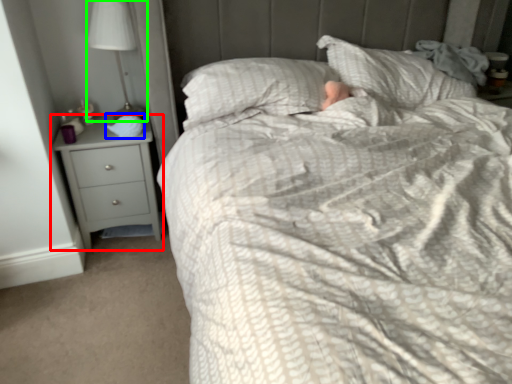
Question: Which is farther away from chest of drawers (highlighted by a red box)? sleeping bag (highlighted by a blue box) or lamp (highlighted by a green box)?

Choices:
 (A) sleeping bag
 (B) lamp

Answer: (B)